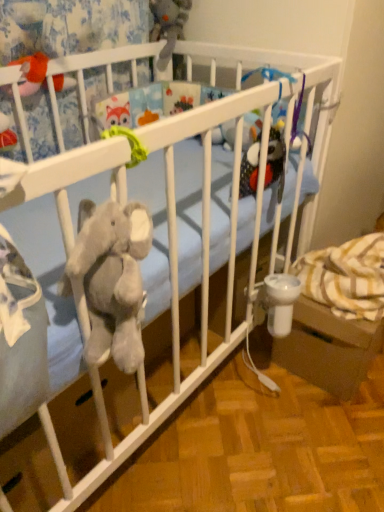
Question: Would you say white plastic baby carriage at lower right contains fuzzy orange toy at upper left, which appears as the 1th toy when ordered from the bottom?

Choices:
 (A) yes
 (B) no

Answer: (B)

Question: Is white plastic baby carriage at lower right at the right side of fuzzy orange toy at upper left, which is the second toy from top to bottom?

Choices:
 (A) no
 (B) yes

Answer: (B)

Question: From the image's perspective, does white plastic baby carriage at lower right appear lower than fuzzy orange toy at upper left, which is the second toy from top to bottom?

Choices:
 (A) no
 (B) yes

Answer: (B)

Question: From a real-world perspective, is white plastic baby carriage at lower right located beneath fuzzy orange toy at upper left, which ranks as the 2th toy in right-to-left order?

Choices:
 (A) no
 (B) yes

Answer: (B)

Question: Can you confirm if white plastic baby carriage at lower right is smaller than fuzzy orange toy at upper left, which ranks as the 1th toy in front-to-back order?

Choices:
 (A) yes
 (B) no

Answer: (B)

Question: Is white plastic baby carriage at lower right in front of fuzzy orange toy at upper left, acting as the 2th toy starting from the back?

Choices:
 (A) yes
 (B) no

Answer: (B)

Question: From a real-world perspective, is gray plush toy at upper center, the 2th toy in the front-to-back sequence, physically below fuzzy orange toy at upper left, which is the second toy from top to bottom?

Choices:
 (A) no
 (B) yes

Answer: (A)

Question: Considering the relative sizes of gray plush toy at upper center, which ranks as the 2th toy in bottom-to-top order, and fuzzy orange toy at upper left, which appears as the 1th toy when ordered from the bottom, in the image provided, is gray plush toy at upper center, which ranks as the 2th toy in bottom-to-top order, smaller than fuzzy orange toy at upper left, which appears as the 1th toy when ordered from the bottom,?

Choices:
 (A) yes
 (B) no

Answer: (B)

Question: Are gray plush toy at upper center, which appears as the 1th toy when viewed from the right, and fuzzy orange toy at upper left, which appears as the 1th toy when ordered from the bottom, far apart?

Choices:
 (A) no
 (B) yes

Answer: (A)

Question: Can you confirm if gray plush toy at upper center, which is counted as the first toy, starting from the top, is thinner than fuzzy orange toy at upper left, which appears as the 1th toy when ordered from the bottom?

Choices:
 (A) yes
 (B) no

Answer: (B)

Question: From the image's perspective, is gray plush toy at upper center, the 2th toy in the front-to-back sequence, below fuzzy orange toy at upper left, the first toy when ordered from left to right?

Choices:
 (A) no
 (B) yes

Answer: (A)

Question: From the image's perspective, is gray plush toy at upper center, which is counted as the first toy, starting from the top, on top of fuzzy orange toy at upper left, which is the second toy from top to bottom?

Choices:
 (A) no
 (B) yes

Answer: (B)

Question: Is white plastic baby carriage at lower right completely or partially outside of gray plush toy at upper center, which ranks as the 2th toy in bottom-to-top order?

Choices:
 (A) yes
 (B) no

Answer: (A)